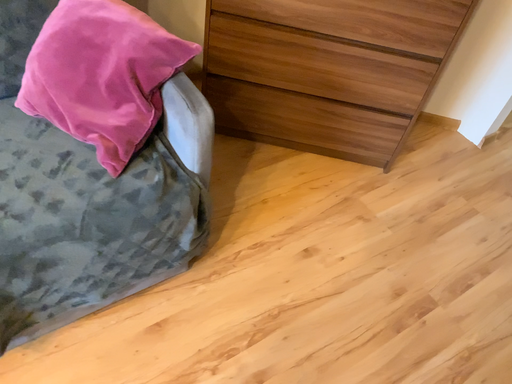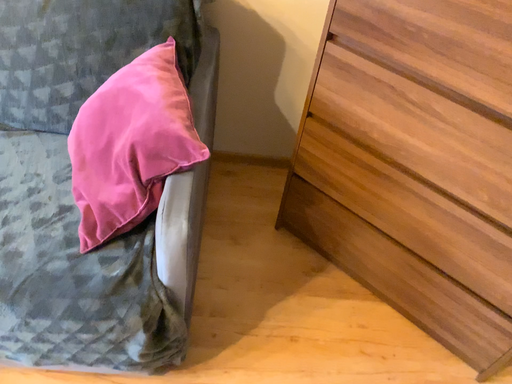
Question: Which way did the camera rotate in the video?

Choices:
 (A) rotated left
 (B) rotated right

Answer: (A)